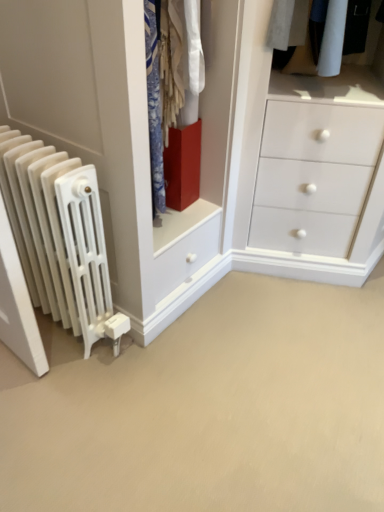
Question: From a real-world perspective, is white matte radiator at left physically below white matte radiator at left?

Choices:
 (A) no
 (B) yes

Answer: (B)

Question: From the image's perspective, is white matte radiator at left above white matte radiator at left?

Choices:
 (A) no
 (B) yes

Answer: (A)

Question: Is white matte radiator at left looking in the opposite direction of white matte radiator at left?

Choices:
 (A) yes
 (B) no

Answer: (B)

Question: Is white matte radiator at left smaller than white matte radiator at left?

Choices:
 (A) yes
 (B) no

Answer: (B)

Question: Does white matte radiator at left appear on the left side of white matte radiator at left?

Choices:
 (A) no
 (B) yes

Answer: (A)

Question: Is matte red cube at center taller or shorter than white matte radiator at left?

Choices:
 (A) tall
 (B) short

Answer: (A)

Question: Based on their positions, is matte red cube at center located to the left or right of white matte radiator at left?

Choices:
 (A) left
 (B) right

Answer: (A)

Question: Is point (228, 101) closer or farther from the camera than point (94, 425)?

Choices:
 (A) farther
 (B) closer

Answer: (A)

Question: Is matte red cube at center in front of or behind white matte radiator at left in the image?

Choices:
 (A) front
 (B) behind

Answer: (B)

Question: From the image's perspective, is matte red cube at center above or below white matte radiator at left?

Choices:
 (A) above
 (B) below

Answer: (A)

Question: From their relative heights in the image, would you say matte red cube at center is taller or shorter than white matte radiator at left?

Choices:
 (A) tall
 (B) short

Answer: (B)

Question: From a real-world perspective, is matte red cube at center physically located above or below white matte radiator at left?

Choices:
 (A) below
 (B) above

Answer: (B)

Question: Visually, is matte red cube at center positioned to the left or to the right of white matte radiator at left?

Choices:
 (A) right
 (B) left

Answer: (A)

Question: From a real-world perspective, is white matte radiator at left positioned above or below matte red cube at center?

Choices:
 (A) below
 (B) above

Answer: (A)

Question: Which is correct: white matte radiator at left is inside matte red cube at center, or outside of it?

Choices:
 (A) outside
 (B) inside

Answer: (A)